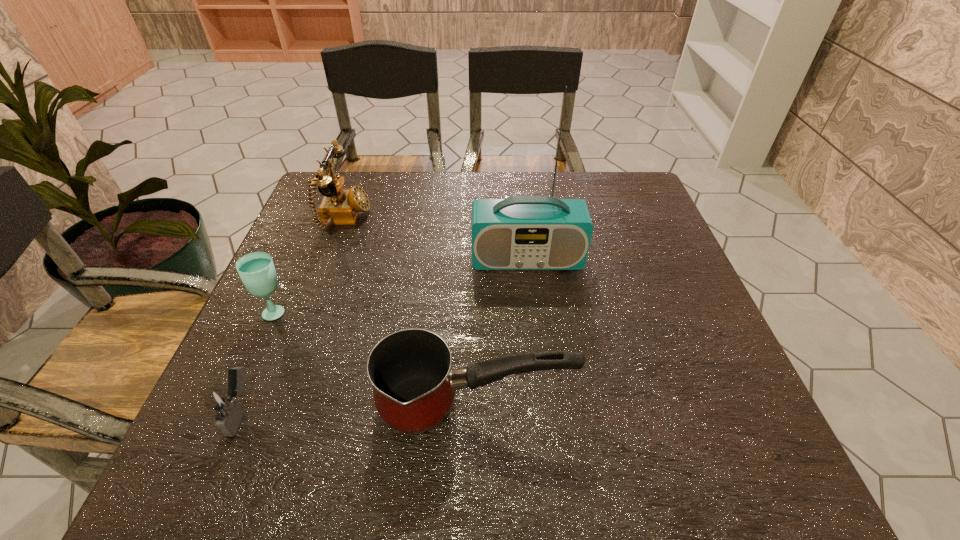
At what (x,y) coordinates should I click in order to perform the action: click on vacant area that lies between the glass and the fourth shortest object. Please return your answer as a coordinate pair (x, y). Looking at the image, I should click on (310, 265).

You are a GUI agent. You are given a task and a screenshot of the screen. Output one action in this format:
    pyautogui.click(x=<x>, y=<y>)
    Task: Click on the empty space that is in between the igniter and the tallest object
    This screenshot has width=960, height=540.
    Given the screenshot: What is the action you would take?
    pyautogui.click(x=384, y=335)

Select which object appears as the second closest to the telephone. Please provide its 2D coordinates. Your answer should be formatted as a tuple, i.e. [(x, y)], where the tuple contains the x and y coordinates of a point satisfying the conditions above.

[(522, 232)]

Locate which object is the closest to the igniter. Please provide its 2D coordinates. Your answer should be formatted as a tuple, i.e. [(x, y)], where the tuple contains the x and y coordinates of a point satisfying the conditions above.

[(256, 270)]

In order to click on vacant space that satisfies the following two spatial constraints: 1. on the front panel of the radio receiver; 2. on the handle side of the saucepan in this screenshot , I will do (543, 406).